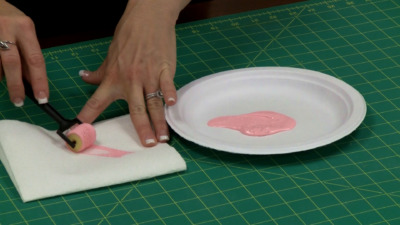
Where is `paper plate`? paper plate is located at coordinates (304, 143).